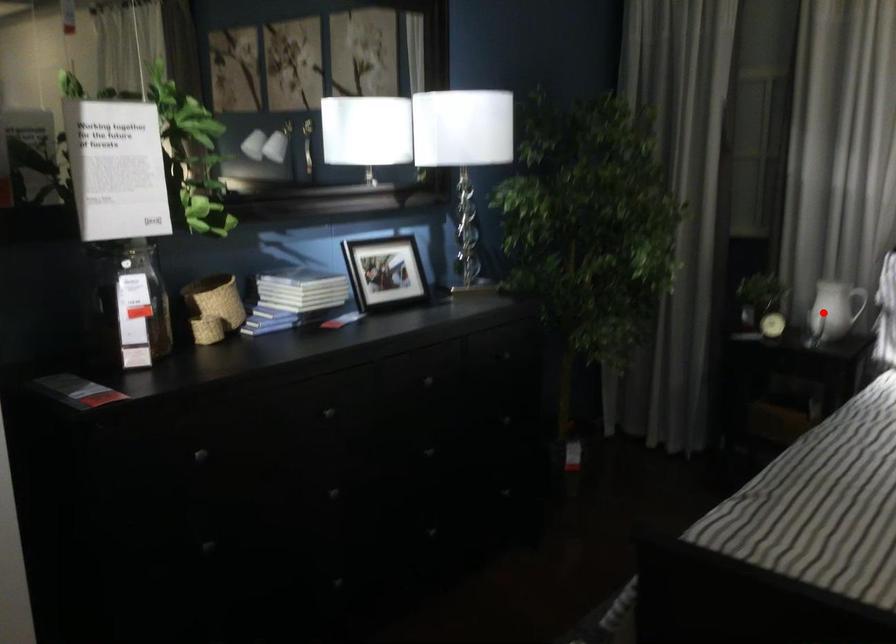
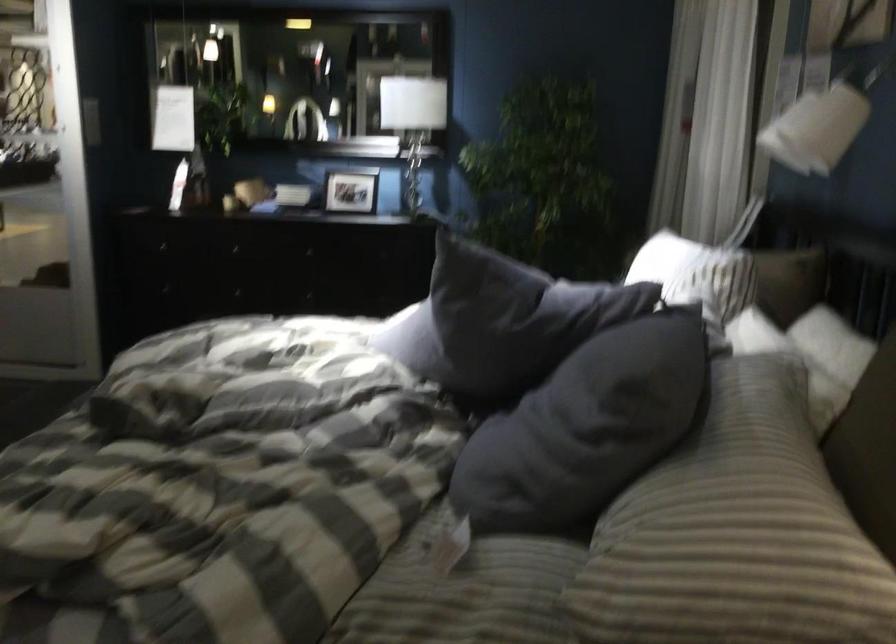
Question: I am providing you with two images of the same scene from different viewpoints. A red point is marked on the first image. Is the red point's position out of view in image 2?

Choices:
 (A) Yes
 (B) No

Answer: (A)